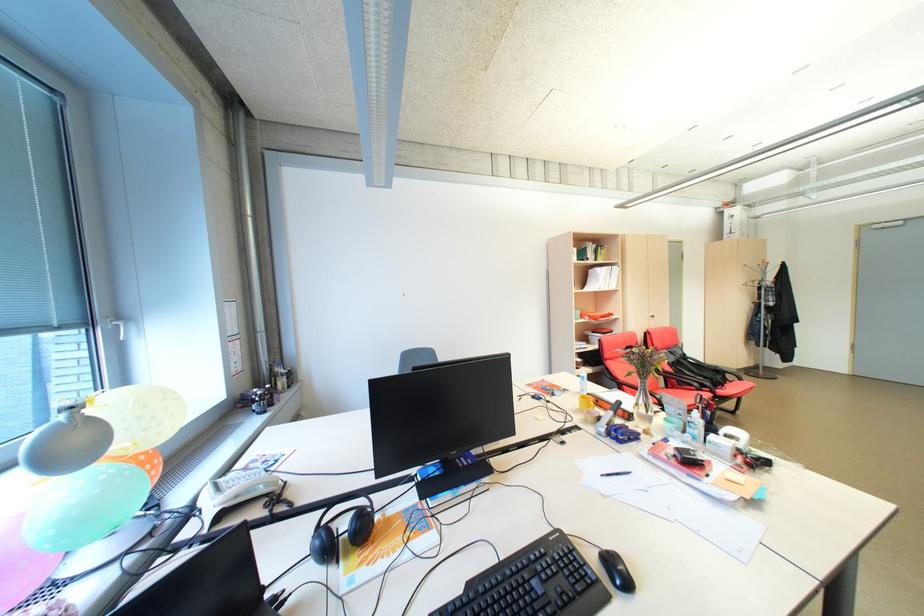
The height and width of the screenshot is (616, 924). What are the coordinates of `black headphones` in the screenshot? It's located at (341, 530).